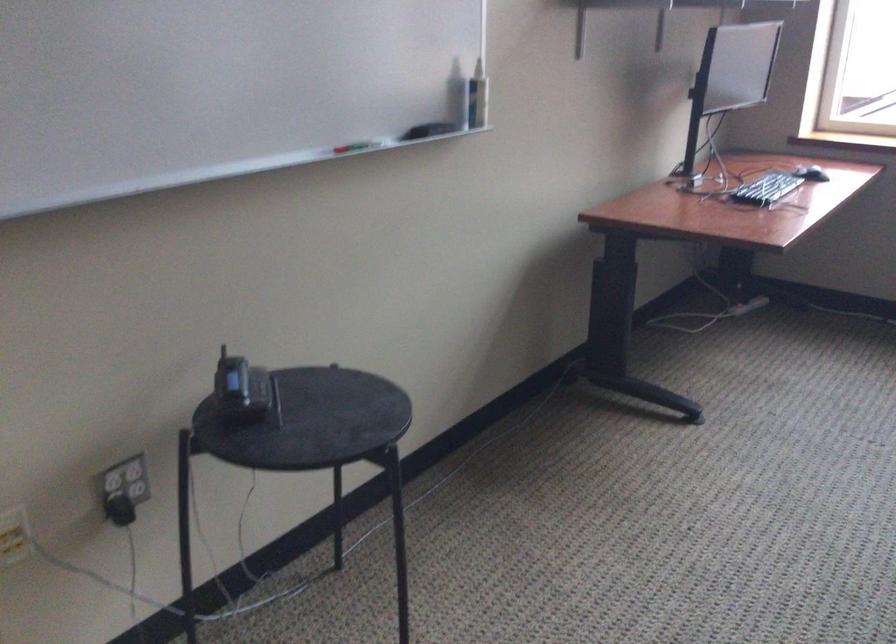
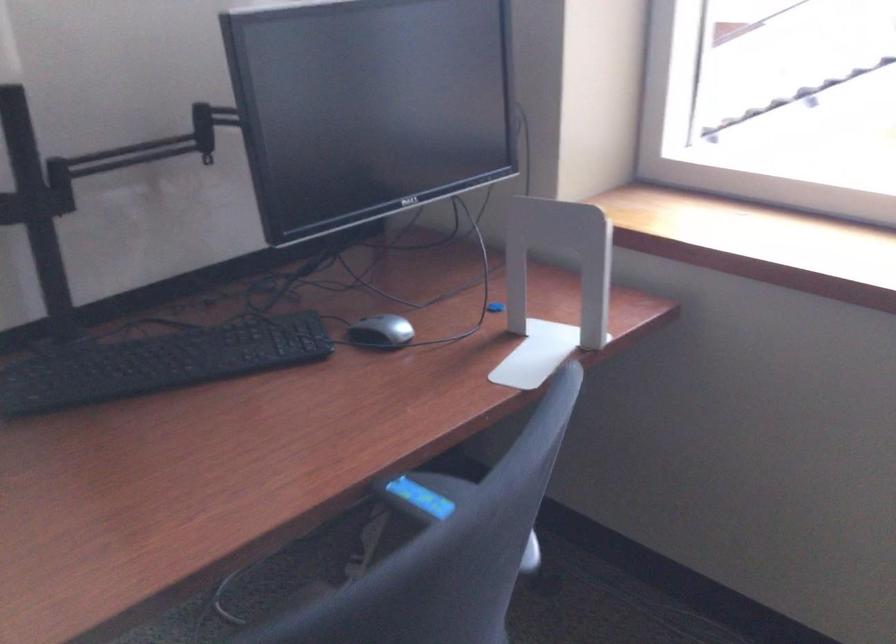
Question: What movement of the cameraman would produce the second image?

Choices:
 (A) Left
 (B) Right
 (C) Forward
 (D) Backward

Answer: (B)